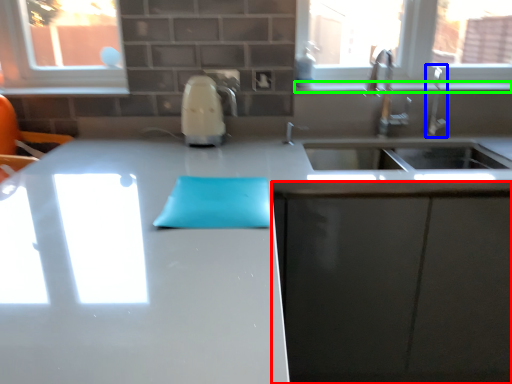
Question: Which object is the farthest from cabinetry (highlighted by a red box)? Choose among these: faucet (highlighted by a blue box) or window sill (highlighted by a green box).

Choices:
 (A) faucet
 (B) window sill

Answer: (B)